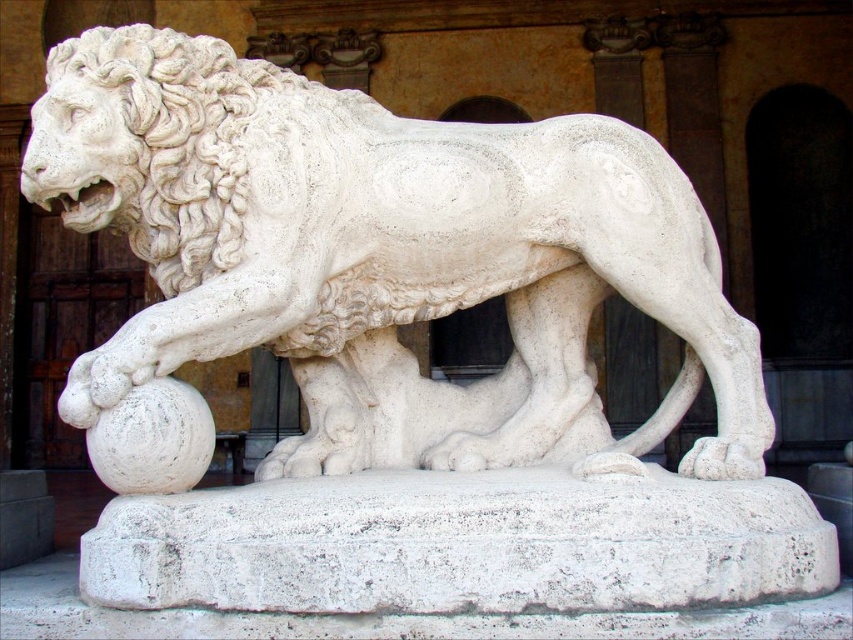
You are an art conservator assessing the spacing between two paws of a lion sculpture. The sculpture has a white stone paw at lower center and a white marble paw at lower center. The recommended minimum distance between such paws for structural stability is 28 inches. Is the current spacing sufficient?

The white stone paw at lower center is 28.63 inches away from the white marble paw at lower center, which exceeds the recommended minimum distance of 28 inches. Therefore, the current spacing is sufficient for structural stability.

You are an art conservator assessing the sculpture. You need to determine if the white stone paw at lower center belongs to the white marble lion at center. Based on the size comparison, what can you conclude?

The white marble lion at center is larger in size than the white stone paw at lower center. This suggests that the white stone paw at lower center is likely a separate piece or part of the base, not part of the lion itself.